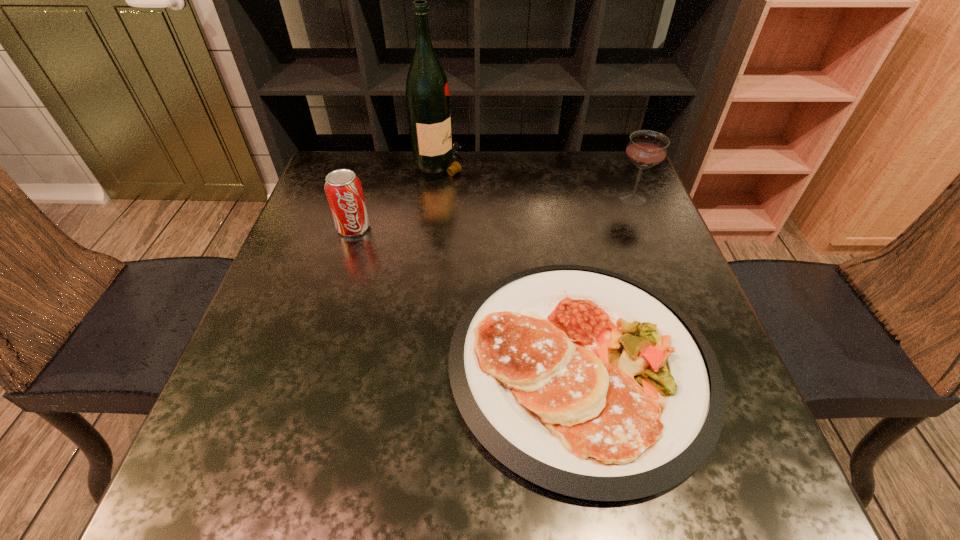
Image resolution: width=960 pixels, height=540 pixels. I want to click on wine bottle, so click(x=427, y=92).

What are the coordinates of `the farthest object` in the screenshot? It's located at (427, 92).

Image resolution: width=960 pixels, height=540 pixels. Find the location of `wineglass`. wineglass is located at coordinates (646, 149).

Locate an element on the screen. This screenshot has height=540, width=960. the leftmost object is located at coordinates (343, 189).

You are a GUI agent. You are given a task and a screenshot of the screen. Output one action in this format:
    pyautogui.click(x=<x>, y=<y>)
    Task: Click on the second shortest object
    This screenshot has width=960, height=540.
    Given the screenshot: What is the action you would take?
    pyautogui.click(x=343, y=189)

Identify the location of the shortest object. The image size is (960, 540). (588, 383).

Identify the location of dish. This screenshot has width=960, height=540. (588, 383).

The height and width of the screenshot is (540, 960). What are the coordinates of `blank space located on the right of the wine bottle` in the screenshot? It's located at (575, 164).

This screenshot has height=540, width=960. I want to click on vacant space located on the left of the third nearest object, so click(546, 198).

Identify the location of vacant space located on the back of the third farthest object. The height and width of the screenshot is (540, 960). (363, 198).